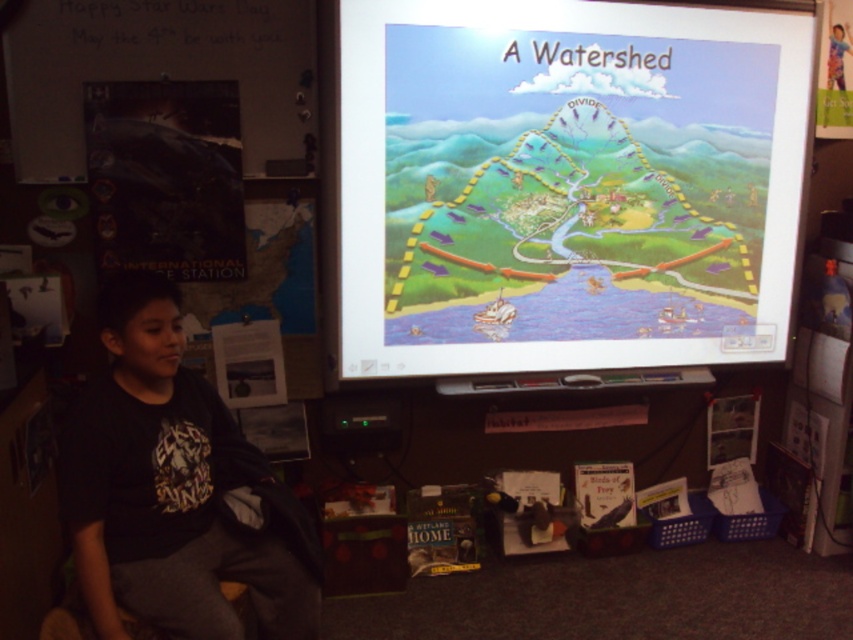
Measure the distance between cartoon map at upper center and camera.

cartoon map at upper center and camera are 7.76 feet apart from each other.

Which of these two, cartoon map at upper center or black cotton shirt at lower left, stands taller?

cartoon map at upper center

Find the location of a particular element. The height and width of the screenshot is (640, 853). cartoon map at upper center is located at coordinates (567, 182).

The image size is (853, 640). Find the location of `cartoon map at upper center`. cartoon map at upper center is located at coordinates (567, 182).